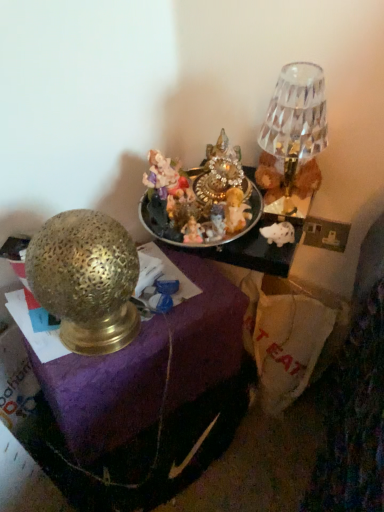
Question: Considering the relative positions of crystal glass lampshade at upper right, arranged as the second lamp when viewed from the left, and gold textured lamp at left, positioned as the second lamp in right-to-left order, in the image provided, is crystal glass lampshade at upper right, arranged as the second lamp when viewed from the left, behind gold textured lamp at left, positioned as the second lamp in right-to-left order,?

Choices:
 (A) no
 (B) yes

Answer: (B)

Question: Is crystal glass lampshade at upper right, the first lamp in the right-to-left sequence, shorter than gold textured lamp at left, acting as the first lamp starting from the left?

Choices:
 (A) no
 (B) yes

Answer: (B)

Question: Considering the relative positions of crystal glass lampshade at upper right, arranged as the first lamp when viewed from the top, and gold textured lamp at left, positioned as the second lamp in right-to-left order, in the image provided, is crystal glass lampshade at upper right, arranged as the first lamp when viewed from the top, to the right of gold textured lamp at left, positioned as the second lamp in right-to-left order, from the viewer's perspective?

Choices:
 (A) yes
 (B) no

Answer: (A)

Question: Is gold textured lamp at left, the 2th lamp viewed from the top, completely or partially inside crystal glass lampshade at upper right, arranged as the second lamp when viewed from the left?

Choices:
 (A) no
 (B) yes

Answer: (A)

Question: Could you tell me if crystal glass lampshade at upper right, arranged as the second lamp when viewed from the left, is turned towards gold textured lamp at left, positioned as the second lamp in right-to-left order?

Choices:
 (A) yes
 (B) no

Answer: (B)

Question: Is crystal glass lampshade at upper right, the second lamp positioned from the bottom, thinner than gold textured lamp at left, the first lamp in the bottom-to-top sequence?

Choices:
 (A) no
 (B) yes

Answer: (B)

Question: Is the surface of gold textured lamp at left in direct contact with gold textured lamp at left, the 2th lamp viewed from the top?

Choices:
 (A) yes
 (B) no

Answer: (B)

Question: From the image's perspective, does gold textured lamp at left appear lower than gold textured lamp at left, the 2th lamp viewed from the top?

Choices:
 (A) no
 (B) yes

Answer: (B)

Question: Is gold textured lamp at left aimed at gold textured lamp at left, the 2th lamp viewed from the top?

Choices:
 (A) no
 (B) yes

Answer: (A)

Question: Is gold textured lamp at left, positioned as the second lamp in right-to-left order, at the back of gold textured lamp at left?

Choices:
 (A) yes
 (B) no

Answer: (B)

Question: Is the position of gold textured lamp at left more distant than that of gold textured lamp at left, acting as the first lamp starting from the left?

Choices:
 (A) yes
 (B) no

Answer: (A)

Question: Would you say gold textured lamp at left, acting as the first lamp starting from the left, is part of gold textured lamp at left's contents?

Choices:
 (A) no
 (B) yes

Answer: (A)

Question: Considering the relative sizes of shiny metallic tray at center and gold textured lamp at left, the first lamp in the bottom-to-top sequence, in the image provided, is shiny metallic tray at center bigger than gold textured lamp at left, the first lamp in the bottom-to-top sequence,?

Choices:
 (A) no
 (B) yes

Answer: (A)